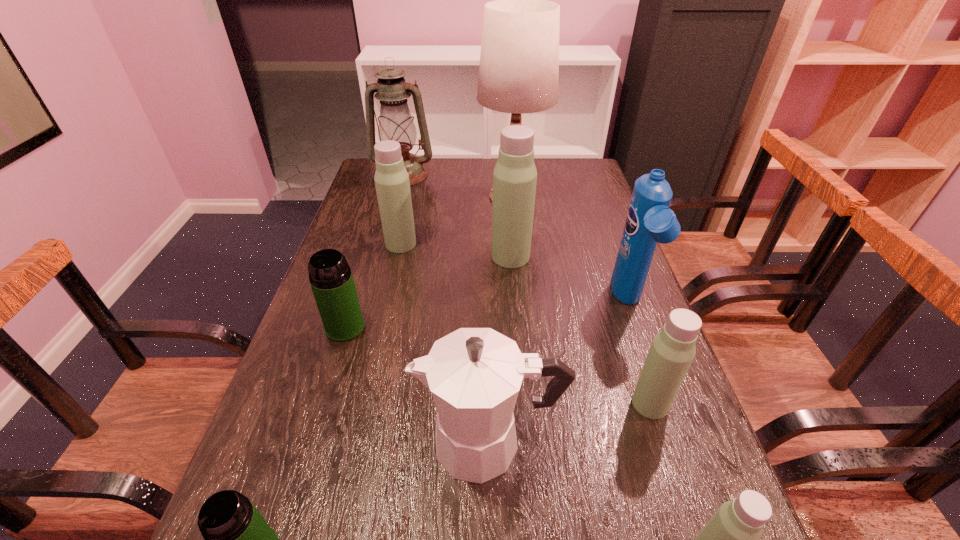
Where is `lamp`? This screenshot has width=960, height=540. lamp is located at coordinates (519, 62).

You are a GUI agent. You are given a task and a screenshot of the screen. Output one action in this format:
    pyautogui.click(x=<x>, y=<y>)
    Task: Click on the oil lamp
    This screenshot has height=540, width=960.
    Given the screenshot: What is the action you would take?
    pyautogui.click(x=395, y=123)

This screenshot has height=540, width=960. I want to click on the third thermos bottle from right to left, so click(x=515, y=176).

This screenshot has width=960, height=540. I want to click on the tallest thermos bottle, so click(515, 176).

Where is `shampoo`? shampoo is located at coordinates (649, 220).

The image size is (960, 540). In order to click on the third smallest light thermos bottle in this screenshot , I will do `click(391, 178)`.

Identify the location of the second tallest thermos bottle. The height and width of the screenshot is (540, 960). (391, 178).

I want to click on coffeepot, so click(x=474, y=374).

You are a GUI agent. You are given a task and a screenshot of the screen. Output one action in this format:
    pyautogui.click(x=<x>, y=<y>)
    Task: Click on the farther green thermos bottle
    The height and width of the screenshot is (540, 960).
    Given the screenshot: What is the action you would take?
    pyautogui.click(x=331, y=279)

You are a GUI agent. You are given a task and a screenshot of the screen. Output one action in this format:
    pyautogui.click(x=<x>, y=<y>)
    Task: Click on the bigger green thermos bottle
    This screenshot has width=960, height=540.
    Given the screenshot: What is the action you would take?
    331,279